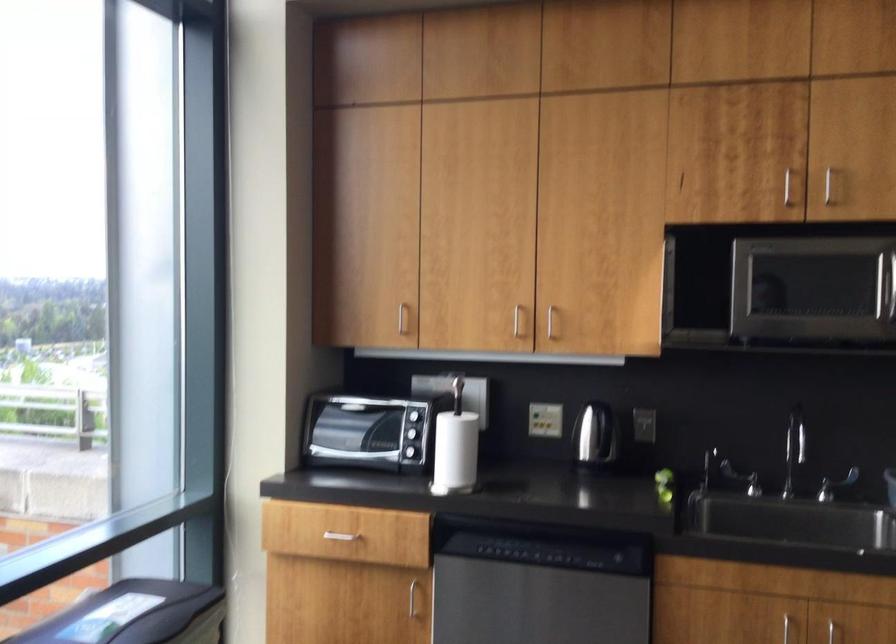
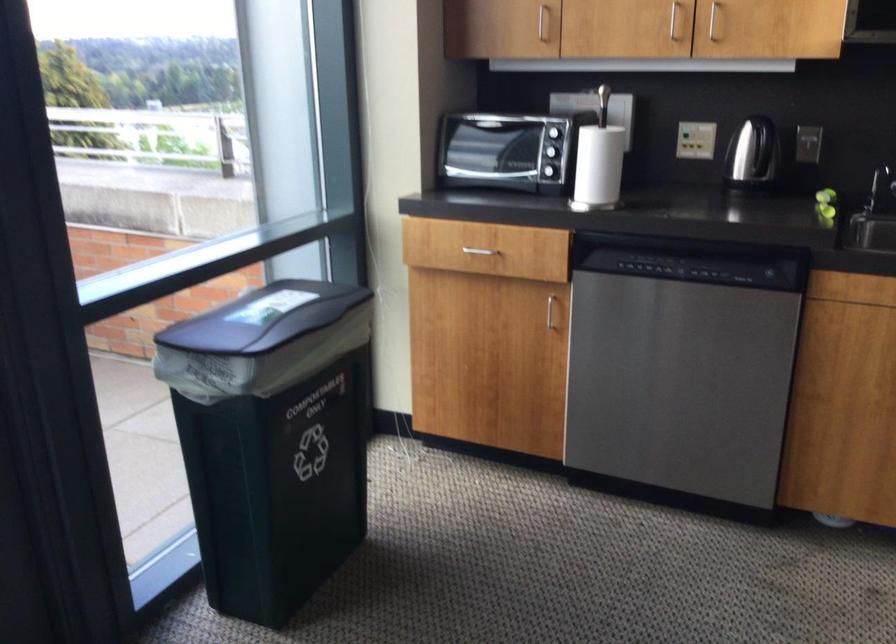
Where in the second image is the point corresponding to the point at 524,325 from the first image?

(673, 20)